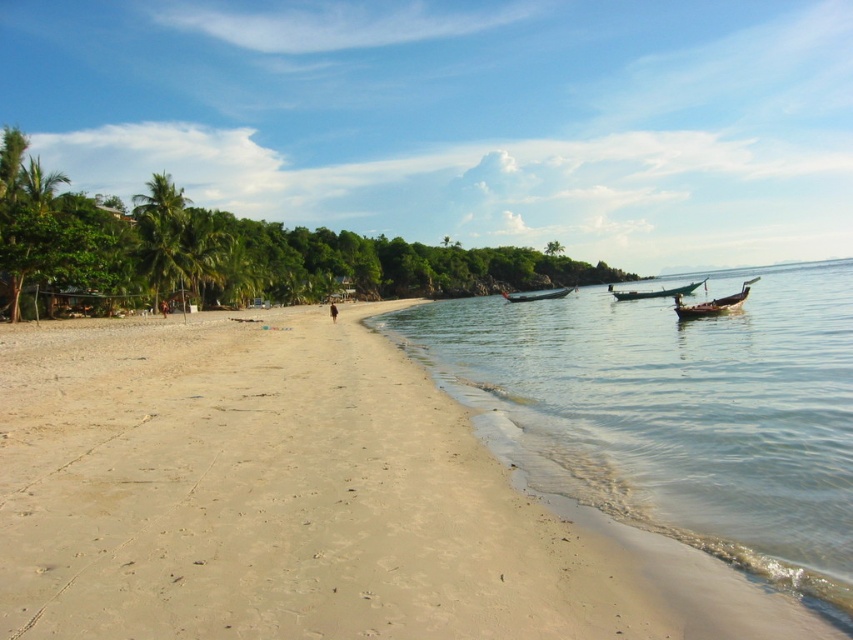
Question: Which of the following is the farthest from the observer?

Choices:
 (A) wooden boat at center
 (B) clear water at lower right
 (C) wooden longboat at right

Answer: (A)

Question: From the image, what is the correct spatial relationship of green leafy palm tree at left in relation to wooden longboat at right?

Choices:
 (A) above
 (B) below

Answer: (A)

Question: Which point is closer to the camera?

Choices:
 (A) (680, 300)
 (B) (698, 280)
 (C) (148, 237)

Answer: (A)

Question: Can you confirm if wooden longboat at right is positioned above green wooden boat at right?

Choices:
 (A) yes
 (B) no

Answer: (B)

Question: Is clear water at lower right behind wooden longboat at right?

Choices:
 (A) no
 (B) yes

Answer: (A)

Question: Considering the real-world distances, which object is farthest from the wooden longboat at right?

Choices:
 (A) clear water at lower right
 (B) green leafy palm tree at left

Answer: (B)